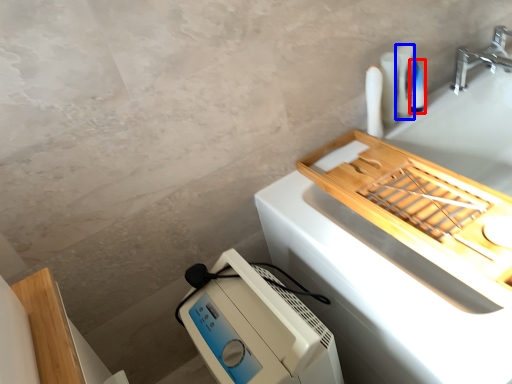
Question: Which of the following is the farthest to the observer, toiletry (highlighted by a red box) or toiletry (highlighted by a blue box)?

Choices:
 (A) toiletry
 (B) toiletry

Answer: (A)